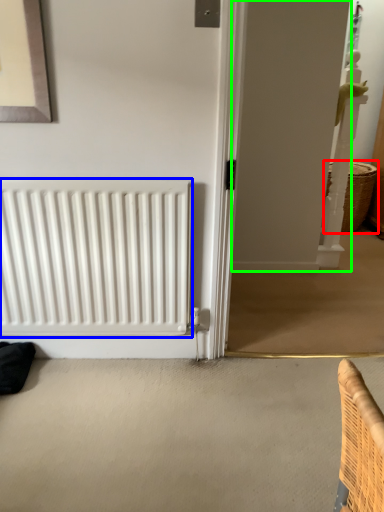
Question: Which object is the closest to the basket (highlighted by a red box)? Choose among these: radiator (highlighted by a blue box) or screen door (highlighted by a green box).

Choices:
 (A) radiator
 (B) screen door

Answer: (B)